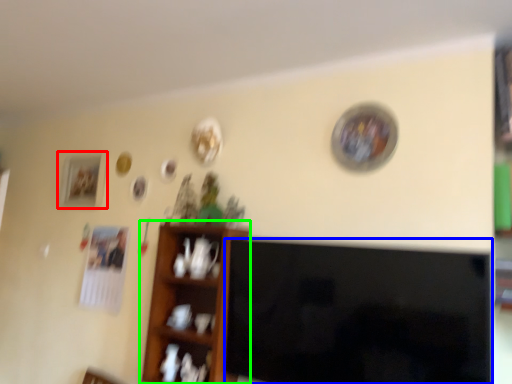
Question: Which is nearer to the picture frame (highlighted by a red box)? television (highlighted by a blue box) or shelf (highlighted by a green box).

Choices:
 (A) television
 (B) shelf

Answer: (B)